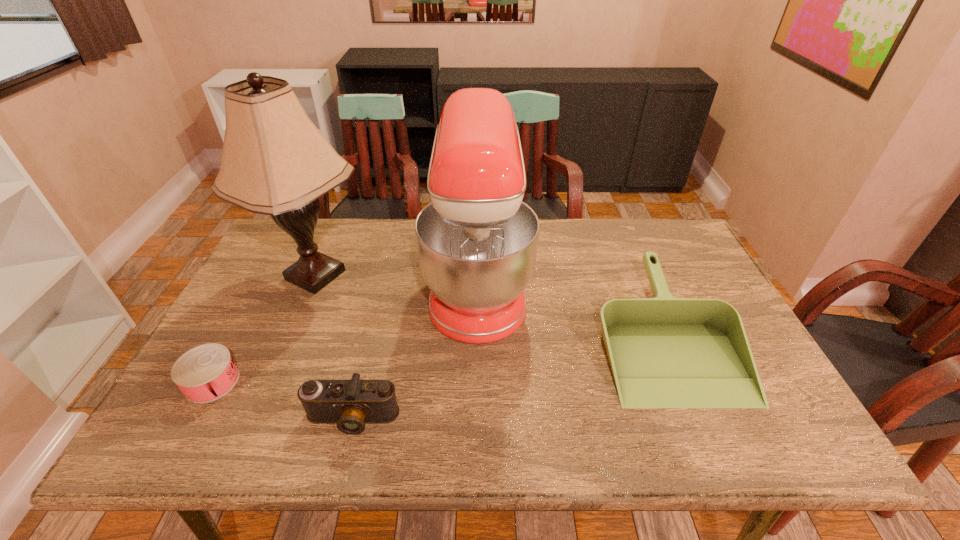
In the image, there is a desktop. Identify the location of free region at the far left corner. (265, 251).

Locate an element on the screen. The image size is (960, 540). free space at the far right corner of the desktop is located at coordinates (673, 238).

Where is `vacant space that is in between the rightmost object and the mixer`? The width and height of the screenshot is (960, 540). vacant space that is in between the rightmost object and the mixer is located at coordinates (571, 308).

Find the location of a particular element. This screenshot has width=960, height=540. free point between the camera and the dustpan is located at coordinates (508, 376).

Find the location of `vacant space that is in between the lamp and the camera`. vacant space that is in between the lamp and the camera is located at coordinates click(334, 347).

Find the location of `empty location between the shortest object and the dustpan`. empty location between the shortest object and the dustpan is located at coordinates (438, 357).

At what (x,y) coordinates should I click in order to perform the action: click on free spot between the dustpan and the camera. Please return your answer as a coordinate pair (x, y). The height and width of the screenshot is (540, 960). Looking at the image, I should click on 508,376.

At what (x,y) coordinates should I click in order to perform the action: click on free space between the shortest object and the fourth shortest object. Please return your answer as a coordinate pair (x, y). This screenshot has width=960, height=540. Looking at the image, I should click on (345, 332).

This screenshot has width=960, height=540. What are the coordinates of `blank region between the lamp and the second object from right to left` in the screenshot? It's located at (396, 279).

Find the location of a particular element. Image resolution: width=960 pixels, height=540 pixels. empty space that is in between the can and the camera is located at coordinates (282, 400).